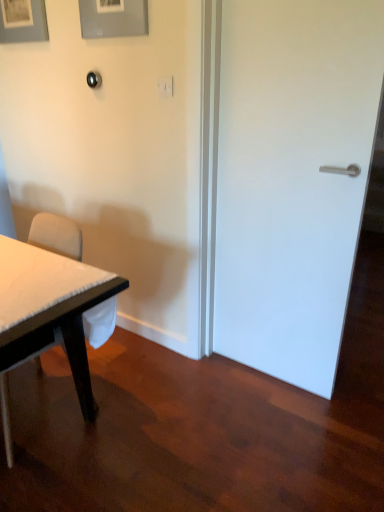
The width and height of the screenshot is (384, 512). I want to click on blank space to the left of white matte door at right, so click(x=202, y=385).